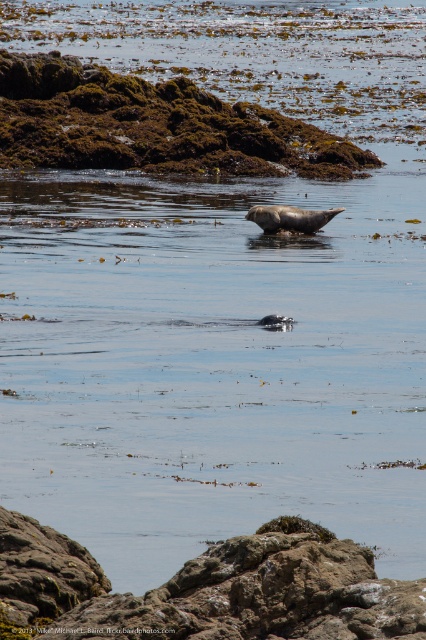
Question: Among these objects, which one is nearest to the camera?

Choices:
 (A) brown rough rock at center
 (B) clear water at center

Answer: (A)

Question: Is clear water at center bigger than brown rough rock at center?

Choices:
 (A) yes
 (B) no

Answer: (A)

Question: Does clear water at center have a greater width compared to brown rough rock at center?

Choices:
 (A) yes
 (B) no

Answer: (A)

Question: Considering the relative positions of clear water at center and brown rough rock at center in the image provided, where is clear water at center located with respect to brown rough rock at center?

Choices:
 (A) right
 (B) left

Answer: (A)

Question: Which object is closer to the camera taking this photo?

Choices:
 (A) clear water at center
 (B) brown rough rock at center

Answer: (B)

Question: Which point is farther from the camera taking this photo?

Choices:
 (A) (111, 637)
 (B) (259, 276)

Answer: (B)